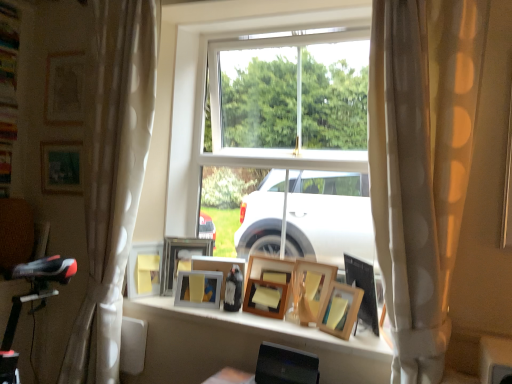
This screenshot has height=384, width=512. What are the coordinates of `empty space that is ontop of wooden frame at center (from a real-world perspective)` in the screenshot? It's located at (254, 317).